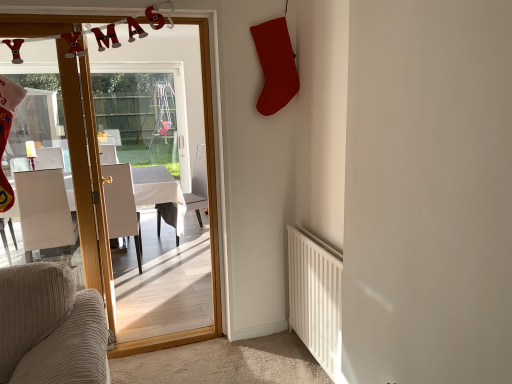
The image size is (512, 384). What are the coordinates of `vacant area on top of white matte radiator at lower right (from a real-world perspective)` in the screenshot? It's located at (318, 243).